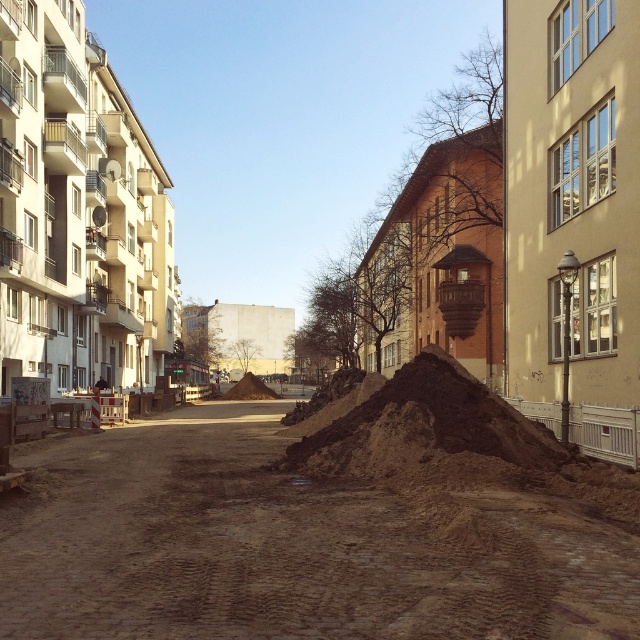
You are a delivery person trying to navigate through the urban street scene. You need to reach the residential building on the left. Is the brown dirt track at center located to the left or right of the residential building?

The brown dirt track at center is located at point [291,545], which is to the right of the residential building on the left.

You are a delivery person trying to navigate through the urban street scene. You need to deliver a package to the residential building on the left. The brown dirt track at center and the brown earth mound at center are in your way. Which one should you go around to reach the building?

The brown dirt track at center is located above the brown earth mound at center, so you should go around the brown earth mound at center to reach the residential building on the left.

You are a delivery person trying to navigate through the construction area in the urban street scene. You see the brown dirt track at center and the brown earth mound at center. Which path should you choose to ensure your vehicle can pass through without getting stuck?

The brown dirt track at center is bigger than the brown earth mound at center, so you should choose the brown dirt track at center as it is larger and more likely to accommodate your vehicle.